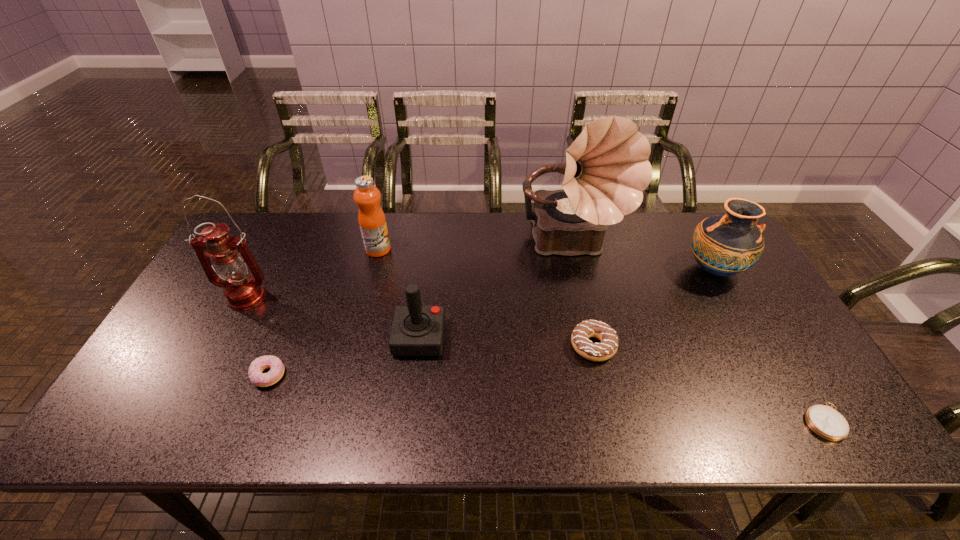
Where is `record player`? record player is located at coordinates (606, 169).

This screenshot has width=960, height=540. In order to click on the second tallest object in this screenshot , I will do `click(242, 291)`.

Where is `oil lamp`? The width and height of the screenshot is (960, 540). oil lamp is located at coordinates (242, 291).

At what (x,y) coordinates should I click in order to perform the action: click on the sixth object from right to left. Please return your answer as a coordinate pair (x, y). The width and height of the screenshot is (960, 540). Looking at the image, I should click on (372, 222).

The image size is (960, 540). Identify the location of pottery. (724, 245).

Where is `joystick`? joystick is located at coordinates (417, 330).

This screenshot has width=960, height=540. In order to click on the fifth object from right to left in this screenshot , I will do `click(417, 330)`.

At what (x,y) coordinates should I click in order to perform the action: click on the right doughnut. Please return your answer as a coordinate pair (x, y). This screenshot has width=960, height=540. Looking at the image, I should click on (601, 351).

At what (x,y) coordinates should I click in order to perform the action: click on the seventh tallest object. Please return your answer as a coordinate pair (x, y). The width and height of the screenshot is (960, 540). Looking at the image, I should click on (255, 374).

Image resolution: width=960 pixels, height=540 pixels. What are the coordinates of `the second object from left to right` in the screenshot? It's located at (255, 374).